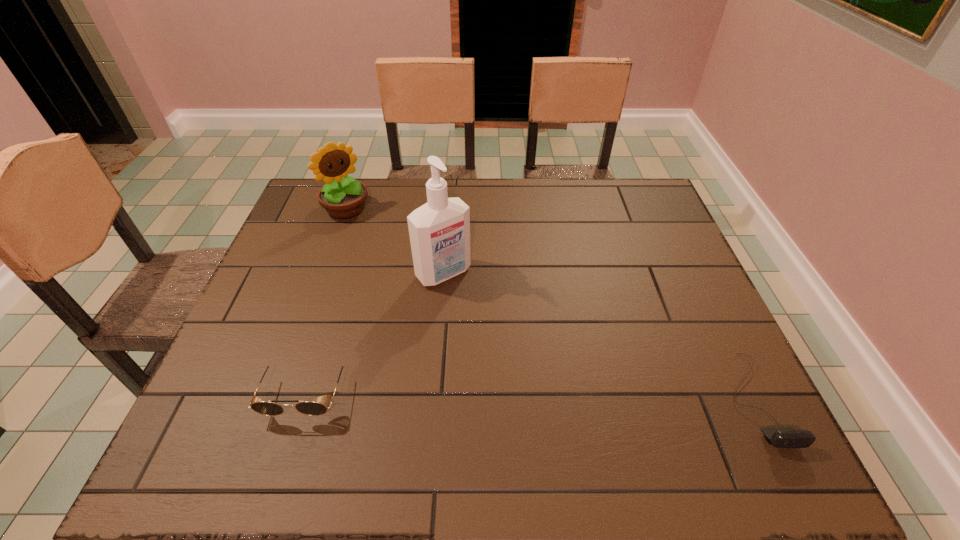
Where is `sunglasses`? sunglasses is located at coordinates (269, 408).

At what (x,y) coordinates should I click in order to perform the action: click on webcam. Please return your answer as a coordinate pair (x, y). Looking at the image, I should click on (781, 437).

Find the location of a particular element. Image resolution: width=960 pixels, height=540 pixels. the shortest object is located at coordinates pos(781,437).

At what (x,y) coordinates should I click in order to perform the action: click on the tallest object. Please return your answer as a coordinate pair (x, y). Looking at the image, I should click on (439, 230).

You are a GUI agent. You are given a task and a screenshot of the screen. Output one action in this format:
    pyautogui.click(x=<x>, y=<y>)
    Task: Click on the third nearest object
    This screenshot has width=960, height=540.
    Given the screenshot: What is the action you would take?
    pyautogui.click(x=439, y=230)

Where is `sunflower`? Image resolution: width=960 pixels, height=540 pixels. sunflower is located at coordinates (343, 197).

Image resolution: width=960 pixels, height=540 pixels. Identify the location of the farthest object. click(x=343, y=197).

At what (x,y) coordinates should I click in order to perform the action: click on vacant space located on the front label of the tallest object. Please return your answer as a coordinate pair (x, y). The image size is (960, 540). Looking at the image, I should click on (507, 341).

Find the location of a particular element. This screenshot has width=960, height=540. vacant area located 0.090m on the front label of the tallest object is located at coordinates (477, 308).

You are a GUI agent. You are given a task and a screenshot of the screen. Output one action in this format:
    pyautogui.click(x=<x>, y=<y>)
    Task: Click on the free region located on the front label of the tallest object
    This screenshot has width=960, height=540.
    Given the screenshot: What is the action you would take?
    pyautogui.click(x=559, y=400)